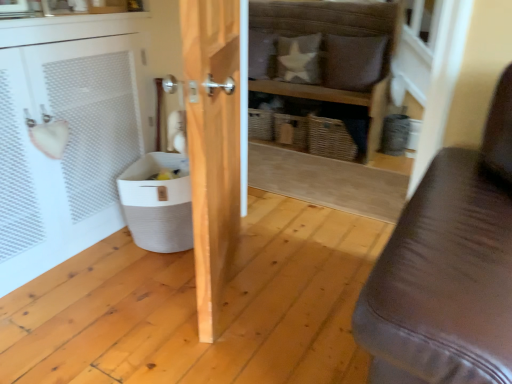
Question: From a real-world perspective, is wooden shelf at center on brown leather pillow at upper center, acting as the second pillow starting from the left?

Choices:
 (A) yes
 (B) no

Answer: (B)

Question: Does wooden shelf at center have a larger size compared to brown leather pillow at upper center, the first pillow from the right?

Choices:
 (A) yes
 (B) no

Answer: (A)

Question: Is wooden shelf at center turned away from brown leather pillow at upper center, acting as the second pillow starting from the left?

Choices:
 (A) no
 (B) yes

Answer: (B)

Question: From the image's perspective, is wooden shelf at center under brown leather pillow at upper center, the first pillow from the right?

Choices:
 (A) no
 (B) yes

Answer: (B)

Question: Are wooden shelf at center and brown leather pillow at upper center, acting as the second pillow starting from the left, located far from each other?

Choices:
 (A) no
 (B) yes

Answer: (A)

Question: Is wooden shelf at center to the right of brown leather pillow at upper center, acting as the second pillow starting from the left, from the viewer's perspective?

Choices:
 (A) no
 (B) yes

Answer: (A)

Question: Is wooden door at center bigger than white fabric pillow at upper center, the second pillow when ordered from right to left?

Choices:
 (A) yes
 (B) no

Answer: (A)

Question: Considering the relative sizes of wooden door at center and white fabric pillow at upper center, the 1th pillow in the left-to-right sequence, in the image provided, is wooden door at center taller than white fabric pillow at upper center, the 1th pillow in the left-to-right sequence,?

Choices:
 (A) no
 (B) yes

Answer: (B)

Question: Does wooden door at center have a smaller size compared to white fabric pillow at upper center, the 1th pillow in the left-to-right sequence?

Choices:
 (A) no
 (B) yes

Answer: (A)

Question: Is wooden door at center turned away from white fabric pillow at upper center, the 1th pillow in the left-to-right sequence?

Choices:
 (A) yes
 (B) no

Answer: (B)

Question: From a real-world perspective, is wooden door at center physically above white fabric pillow at upper center, the 1th pillow in the left-to-right sequence?

Choices:
 (A) yes
 (B) no

Answer: (B)

Question: Does wooden door at center appear on the right side of white fabric pillow at upper center, the second pillow when ordered from right to left?

Choices:
 (A) no
 (B) yes

Answer: (A)

Question: Does white fabric pillow at upper center, the 1th pillow in the left-to-right sequence, touch wooden door at center?

Choices:
 (A) yes
 (B) no

Answer: (B)